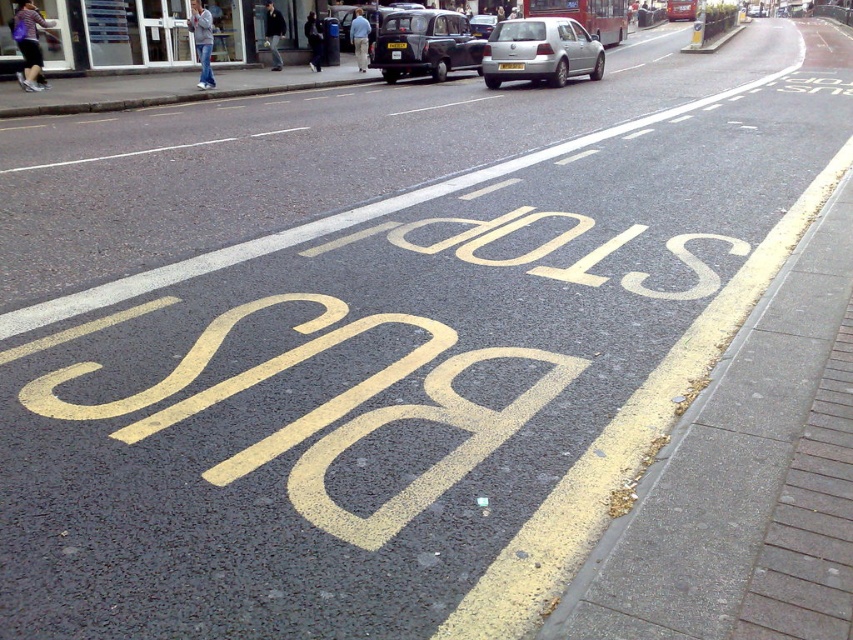
Question: Based on their relative distances, which object is farther from the silver metallic hatchback at center?

Choices:
 (A) black matte taxi at center
 (B) gray concrete curb at upper center

Answer: (B)

Question: Can you confirm if gray concrete curb at upper center is positioned to the left of black matte taxi at center?

Choices:
 (A) no
 (B) yes

Answer: (B)

Question: Which object appears farthest from the camera in this image?

Choices:
 (A) black matte taxi at center
 (B) silver metallic hatchback at center

Answer: (A)

Question: In this image, where is gray concrete curb at upper center located relative to black matte taxi at center?

Choices:
 (A) left
 (B) right

Answer: (A)

Question: Does silver metallic hatchback at center have a larger size compared to black matte taxi at center?

Choices:
 (A) yes
 (B) no

Answer: (B)

Question: Which point is closer to the camera?

Choices:
 (A) pos(518,54)
 (B) pos(418,42)
 (C) pos(68,83)

Answer: (A)